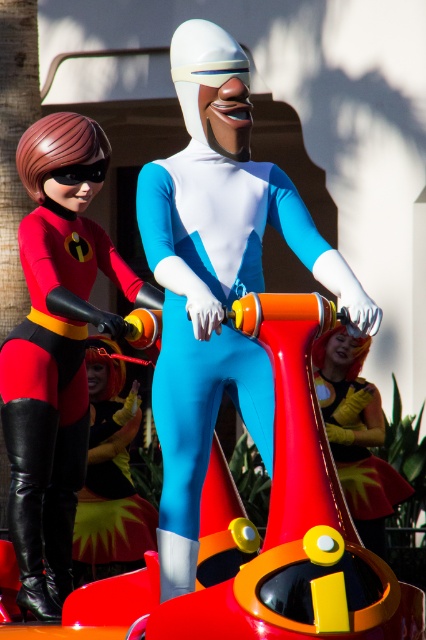
Is white matte suit at center smaller than shiny gold helmet at center?

Actually, white matte suit at center might be larger than shiny gold helmet at center.

Is white matte suit at center taller than shiny gold helmet at center?

Correct, white matte suit at center is much taller as shiny gold helmet at center.

Image resolution: width=426 pixels, height=640 pixels. I want to click on white matte suit at center, so click(216, 278).

Find the location of a particular element. Image resolution: width=426 pixels, height=640 pixels. white matte suit at center is located at coordinates (216, 278).

Does shiny plastic toy car at center have a smaller size compared to shiny metallic helmet at center?

Yes, shiny plastic toy car at center is smaller than shiny metallic helmet at center.

Is shiny plastic toy car at center positioned at the back of shiny metallic helmet at center?

That is False.

This screenshot has height=640, width=426. Identify the location of shiny plastic toy car at center. (267, 534).

Looking at this image, is shiny gold helmet at center taller than shiny metallic helmet at center?

No, shiny gold helmet at center is not taller than shiny metallic helmet at center.

Who is lower down, shiny gold helmet at center or shiny metallic helmet at center?

shiny metallic helmet at center is below.

Where is `shiny gold helmet at center`? The image size is (426, 640). shiny gold helmet at center is located at coordinates (356, 433).